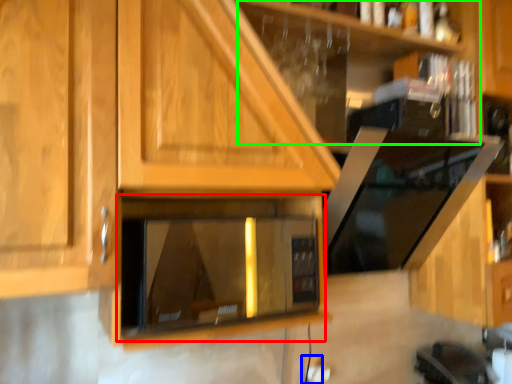
Question: Estimate the real-world distances between objects in this image. Which object is farther from appliance (highlighted by a red box), electric outlet (highlighted by a blue box) or shelf (highlighted by a green box)?

Choices:
 (A) electric outlet
 (B) shelf

Answer: (A)